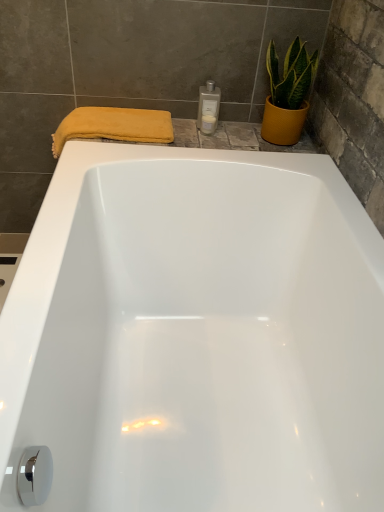
Question: Considering the relative sizes of yellow textured pot at upper right and white glossy bottle at upper right, which appears as the second toiletry when ordered from the bottom, in the image provided, is yellow textured pot at upper right wider than white glossy bottle at upper right, which appears as the second toiletry when ordered from the bottom,?

Choices:
 (A) no
 (B) yes

Answer: (B)

Question: Does yellow textured pot at upper right lie behind white glossy bottle at upper right, which appears as the second toiletry when ordered from the bottom?

Choices:
 (A) yes
 (B) no

Answer: (B)

Question: Can we say yellow textured pot at upper right lies outside white glossy bottle at upper right, which ranks as the 1th toiletry in top-to-bottom order?

Choices:
 (A) no
 (B) yes

Answer: (B)

Question: Considering the relative sizes of yellow textured pot at upper right and white glossy bottle at upper right, which appears as the second toiletry when ordered from the bottom, in the image provided, is yellow textured pot at upper right smaller than white glossy bottle at upper right, which appears as the second toiletry when ordered from the bottom,?

Choices:
 (A) no
 (B) yes

Answer: (A)

Question: Considering the relative sizes of yellow textured pot at upper right and white glossy bottle at upper right, which appears as the second toiletry when ordered from the bottom, in the image provided, is yellow textured pot at upper right bigger than white glossy bottle at upper right, which appears as the second toiletry when ordered from the bottom,?

Choices:
 (A) no
 (B) yes

Answer: (B)

Question: From the image's perspective, would you say yellow textured pot at upper right is positioned over white glossy bottle at upper right, which appears as the second toiletry when ordered from the bottom?

Choices:
 (A) no
 (B) yes

Answer: (B)

Question: From the image's perspective, is white glossy bottle at upper right, which appears as the second toiletry when ordered from the bottom, under yellow soft towel at upper left?

Choices:
 (A) no
 (B) yes

Answer: (A)

Question: From a real-world perspective, is white glossy bottle at upper right, which appears as the second toiletry when ordered from the bottom, on yellow soft towel at upper left?

Choices:
 (A) no
 (B) yes

Answer: (B)

Question: Can you confirm if white glossy bottle at upper right, which ranks as the 1th toiletry in top-to-bottom order, is bigger than yellow soft towel at upper left?

Choices:
 (A) no
 (B) yes

Answer: (A)

Question: Does white glossy bottle at upper right, which appears as the second toiletry when ordered from the bottom, have a smaller size compared to yellow soft towel at upper left?

Choices:
 (A) no
 (B) yes

Answer: (B)

Question: Would you say white glossy bottle at upper right, which appears as the second toiletry when ordered from the bottom, is outside yellow soft towel at upper left?

Choices:
 (A) yes
 (B) no

Answer: (A)

Question: Can you confirm if white glossy bottle at upper right, which appears as the second toiletry when ordered from the bottom, is shorter than yellow soft towel at upper left?

Choices:
 (A) no
 (B) yes

Answer: (B)

Question: From the image's perspective, is yellow soft towel at upper left below white glossy bottle at upper center, the second toiletry positioned from the top?

Choices:
 (A) no
 (B) yes

Answer: (B)